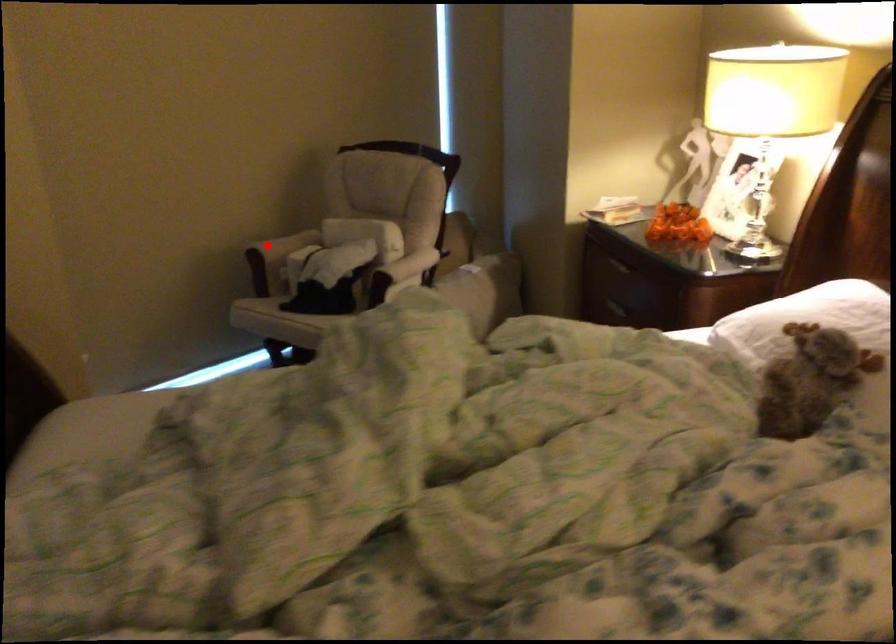
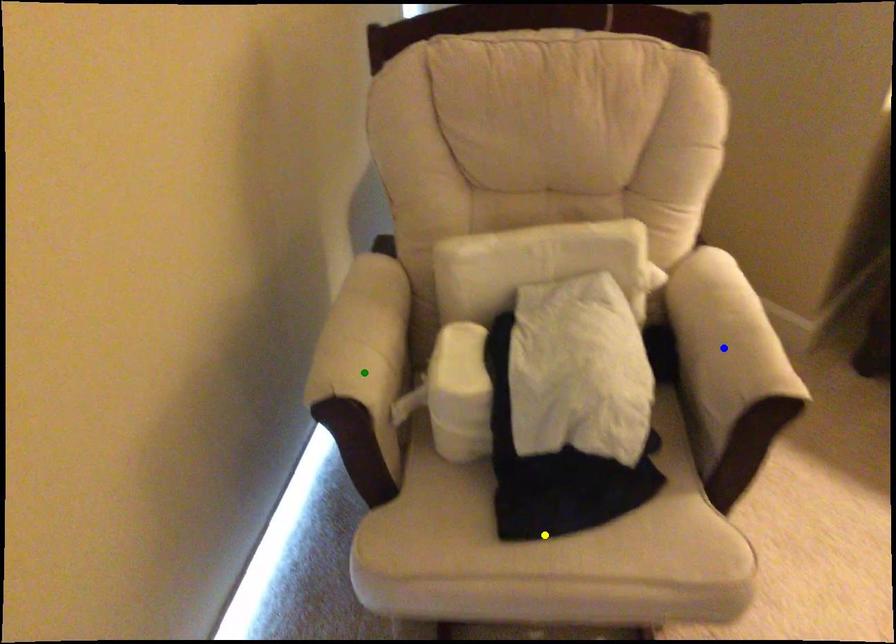
Question: I am providing you with two images of the same scene from different viewpoints. A red point is marked on the first image. You are given multiple points on the second image. Which mark in image 2 goes with the point in image 1?

Choices:
 (A) blue point
 (B) green point
 (C) yellow point

Answer: (B)